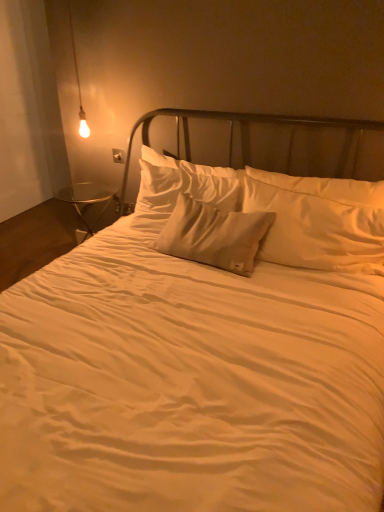
Question: Can you confirm if matte glass bulb at upper left is wider than satin beige pillow at center, the 1th pillow viewed from the back?

Choices:
 (A) no
 (B) yes

Answer: (A)

Question: Is matte glass bulb at upper left to the left of satin beige pillow at center, placed as the 2th pillow when sorted from front to back, from the viewer's perspective?

Choices:
 (A) no
 (B) yes

Answer: (B)

Question: Are matte glass bulb at upper left and satin beige pillow at center, placed as the 2th pillow when sorted from front to back, making contact?

Choices:
 (A) yes
 (B) no

Answer: (B)

Question: Is matte glass bulb at upper left behind satin beige pillow at center, the 1th pillow viewed from the back?

Choices:
 (A) no
 (B) yes

Answer: (B)

Question: Can you confirm if matte glass bulb at upper left is bigger than satin beige pillow at center, the 1th pillow viewed from the back?

Choices:
 (A) yes
 (B) no

Answer: (B)

Question: From the image's perspective, is matte glass bulb at upper left located above satin beige pillow at center, placed as the 2th pillow when sorted from front to back?

Choices:
 (A) no
 (B) yes

Answer: (B)

Question: Considering the relative positions of satin beige pillow at center, the 1th pillow viewed from the back, and matte glass bulb at upper left in the image provided, is satin beige pillow at center, the 1th pillow viewed from the back, to the left of matte glass bulb at upper left from the viewer's perspective?

Choices:
 (A) no
 (B) yes

Answer: (A)

Question: From a real-world perspective, is satin beige pillow at center, placed as the 2th pillow when sorted from front to back, located higher than matte glass bulb at upper left?

Choices:
 (A) no
 (B) yes

Answer: (A)

Question: Can you confirm if satin beige pillow at center, the 1th pillow viewed from the back, is bigger than matte glass bulb at upper left?

Choices:
 (A) no
 (B) yes

Answer: (B)

Question: Can you confirm if satin beige pillow at center, the 1th pillow viewed from the back, is smaller than matte glass bulb at upper left?

Choices:
 (A) no
 (B) yes

Answer: (A)

Question: Is satin beige pillow at center, the 1th pillow viewed from the back, aimed at matte glass bulb at upper left?

Choices:
 (A) no
 (B) yes

Answer: (A)

Question: Would you say satin beige pillow at center, placed as the 2th pillow when sorted from front to back, contains matte glass bulb at upper left?

Choices:
 (A) yes
 (B) no

Answer: (B)

Question: Does satin beige pillow at center, placed as the 2th pillow when sorted from front to back, touch matte plastic electric outlet at lower left, the second electric outlet from the top?

Choices:
 (A) yes
 (B) no

Answer: (B)